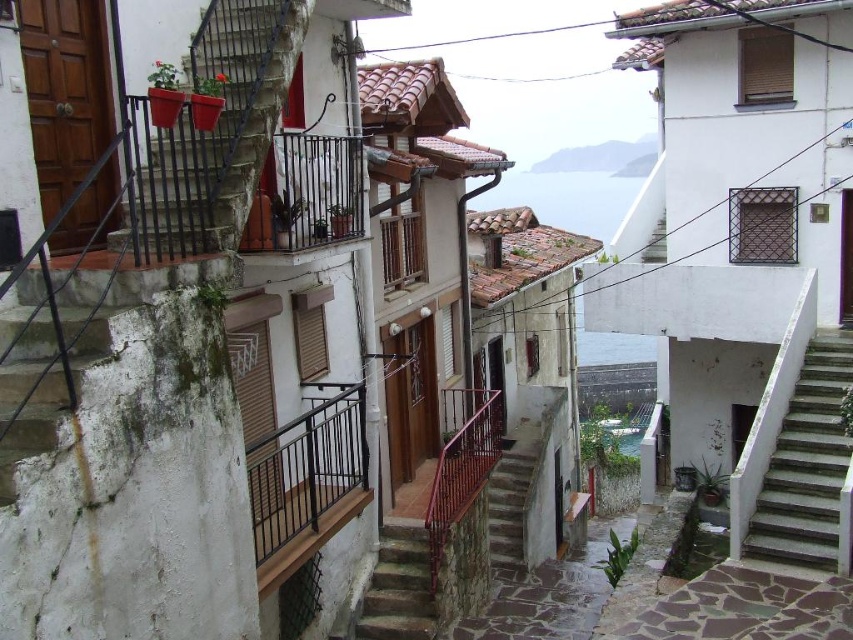
Can you confirm if concrete stairs at right is smaller than smooth stone cliff at upper center?

Correct, concrete stairs at right occupies less space than smooth stone cliff at upper center.

Consider the image. Which is more to the left, concrete stairs at right or smooth stone cliff at upper center?

Answer: concrete stairs at right is more to the left.

Is point (787, 419) farther from viewer compared to point (567, 168)?

No.

Locate an element on the screen. The image size is (853, 640). concrete stairs at right is located at coordinates (805, 465).

Who is taller, concrete stairs at center or white concrete stairs at upper center?

Standing taller between the two is concrete stairs at center.

Which is behind, point (519, 545) or point (654, 227)?

Positioned behind is point (654, 227).

What do you see at coordinates (509, 506) in the screenshot? The width and height of the screenshot is (853, 640). I see `concrete stairs at center` at bounding box center [509, 506].

Identify the location of concrete stairs at center. (509, 506).

Based on the photo, does smooth stone cliff at upper center appear over white concrete stairs at upper center?

Indeed, smooth stone cliff at upper center is positioned over white concrete stairs at upper center.

Is smooth stone cliff at upper center in front of white concrete stairs at upper center?

No, smooth stone cliff at upper center is further to the viewer.

Is point (607, 150) positioned after point (653, 236)?

That is True.

I want to click on smooth stone cliff at upper center, so click(602, 157).